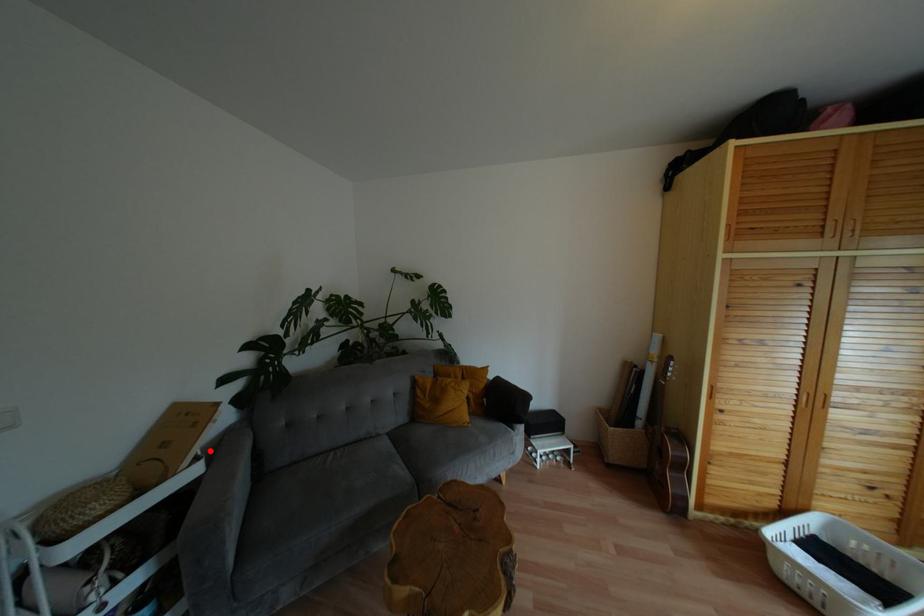
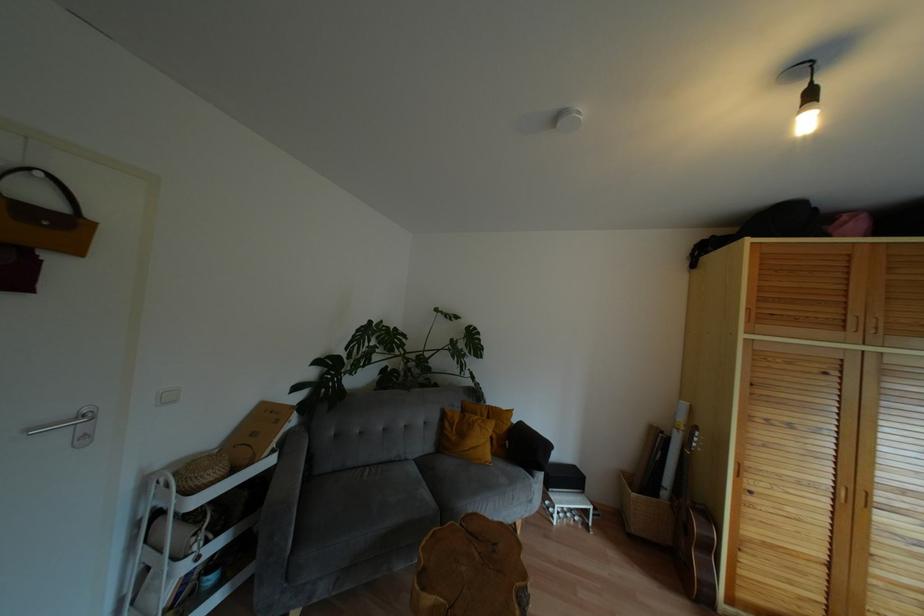
Where in the second image is the point corresponding to the highlighted location from the first image?

(282, 446)